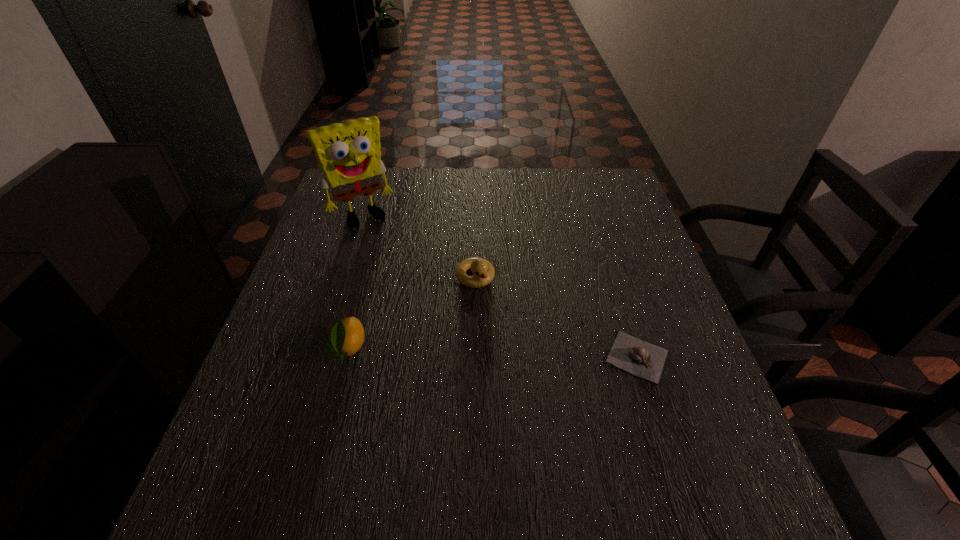
You are a GUI agent. You are given a task and a screenshot of the screen. Output one action in this format:
    pyautogui.click(x=<x>, y=<y>)
    Task: Click on the vacant space on the desktop that is between the lemon and the rightmost object and is positioned on the face of the sponge
    The height and width of the screenshot is (540, 960).
    Given the screenshot: What is the action you would take?
    pyautogui.click(x=449, y=351)

You are a GUI agent. You are given a task and a screenshot of the screen. Output one action in this format:
    pyautogui.click(x=<x>, y=<y>)
    Task: Click on the free space on the desktop that is between the lemon and the rightmost object and is positioned at the beak of the duckling
    
    Given the screenshot: What is the action you would take?
    pyautogui.click(x=519, y=353)